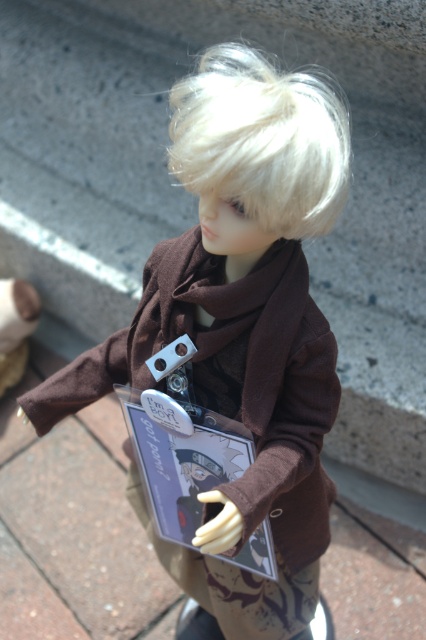
Is matte brown scarf at center bigger than blonde silky hair at center?

Indeed, matte brown scarf at center has a larger size compared to blonde silky hair at center.

What do you see at coordinates (241, 324) in the screenshot? I see `matte brown scarf at center` at bounding box center [241, 324].

This screenshot has height=640, width=426. Identify the location of matte brown scarf at center. (241, 324).

Can you confirm if matte brown scarf at center is wider than matte brown doll at center?

Correct, the width of matte brown scarf at center exceeds that of matte brown doll at center.

Can you confirm if matte brown scarf at center is positioned to the left of matte brown doll at center?

Incorrect, matte brown scarf at center is not on the left side of matte brown doll at center.

Where is `matte brown scarf at center`? matte brown scarf at center is located at coordinates point(241,324).

Identify the location of matte brown scarf at center. The height and width of the screenshot is (640, 426). (241, 324).

Which is above, blonde silky hair at center or matte brown doll at center?

blonde silky hair at center

From the picture: Who is more distant from viewer, (x=278, y=106) or (x=20, y=316)?

The point (x=20, y=316) is more distant.

Between point (238, 150) and point (31, 323), which one is positioned behind?

Positioned behind is point (31, 323).

The width and height of the screenshot is (426, 640). In order to click on blonde silky hair at center in this screenshot , I will do `click(261, 140)`.